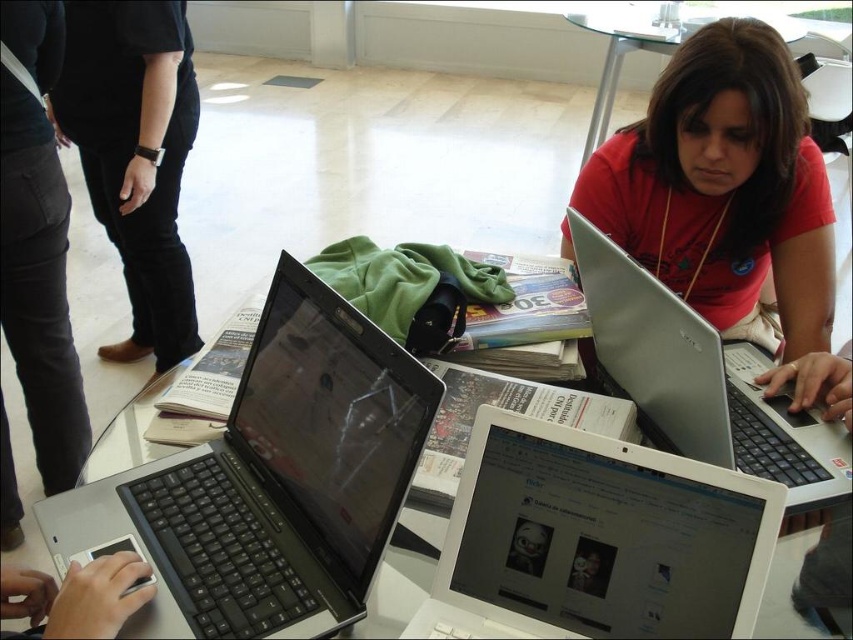
Question: Considering the real-world distances, which object is closest to the silver metallic laptop at center?

Choices:
 (A) white glossy laptop at center
 (B) matte black laptop at center
 (C) black smooth pants at left

Answer: (A)

Question: Does matte red shirt at center have a lesser width compared to black smooth pants at left?

Choices:
 (A) yes
 (B) no

Answer: (B)

Question: Which object is farther from the camera taking this photo?

Choices:
 (A) black plastic laptops at center
 (B) matte black laptop at center
 (C) silver metallic laptop at center
 (D) matte red shirt at center

Answer: (D)

Question: Can you confirm if black plastic laptops at center is wider than black smooth pants at left?

Choices:
 (A) yes
 (B) no

Answer: (B)

Question: Does matte black laptop at center have a smaller size compared to matte red shirt at center?

Choices:
 (A) no
 (B) yes

Answer: (B)

Question: Which object appears closest to the camera in this image?

Choices:
 (A) black smooth pants at left
 (B) black plastic laptops at center
 (C) silver metallic laptop at center
 (D) matte black laptop at center

Answer: (B)